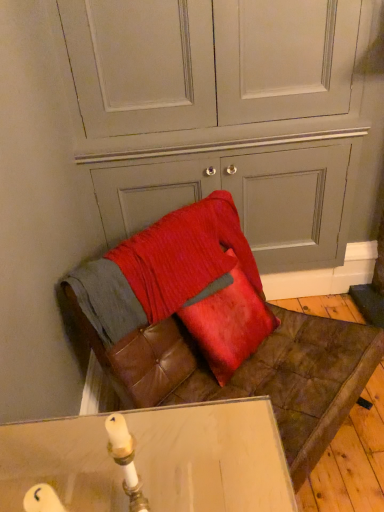
Question: Considering the relative positions of leather cushion at lower center and satin red pillow at center in the image provided, is leather cushion at lower center to the right of satin red pillow at center from the viewer's perspective?

Choices:
 (A) no
 (B) yes

Answer: (A)

Question: Considering the relative sizes of leather cushion at lower center and satin red pillow at center in the image provided, is leather cushion at lower center smaller than satin red pillow at center?

Choices:
 (A) no
 (B) yes

Answer: (A)

Question: From a real-world perspective, is leather cushion at lower center physically below satin red pillow at center?

Choices:
 (A) no
 (B) yes

Answer: (A)

Question: Is leather cushion at lower center further to camera compared to satin red pillow at center?

Choices:
 (A) no
 (B) yes

Answer: (B)

Question: Is satin red pillow at center located within leather cushion at lower center?

Choices:
 (A) yes
 (B) no

Answer: (B)

Question: Would you say leather cushion at lower center is a long distance from satin red pillow at center?

Choices:
 (A) no
 (B) yes

Answer: (A)

Question: Is leather cushion at lower center outside of satin red pillow at center?

Choices:
 (A) no
 (B) yes

Answer: (B)

Question: Can you confirm if leather cushion at lower center is positioned to the left of satin red pillow at center?

Choices:
 (A) no
 (B) yes

Answer: (A)

Question: Is there a large distance between leather cushion at lower center and satin red pillow at center?

Choices:
 (A) no
 (B) yes

Answer: (A)

Question: Considering the relative sizes of leather cushion at lower center and satin red pillow at center in the image provided, is leather cushion at lower center bigger than satin red pillow at center?

Choices:
 (A) yes
 (B) no

Answer: (A)

Question: Is the position of leather cushion at lower center more distant than that of satin red pillow at center?

Choices:
 (A) yes
 (B) no

Answer: (B)

Question: From the image's perspective, is leather cushion at lower center located above satin red pillow at center?

Choices:
 (A) yes
 (B) no

Answer: (B)

Question: From the image's perspective, does satin red pillow at center appear lower than leather cushion at lower center?

Choices:
 (A) no
 (B) yes

Answer: (A)